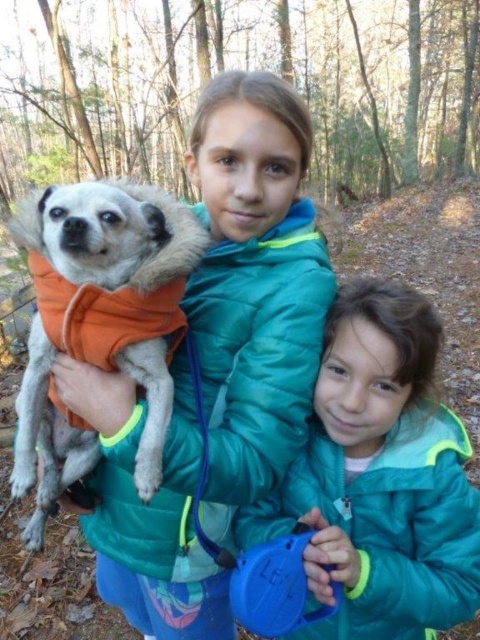
Between orange fleece dog at left and orange fleece vest at left, which one appears on the left side from the viewer's perspective?

Positioned to the left is orange fleece vest at left.

Which is in front, point (292, 410) or point (39, 529)?

Positioned in front is point (292, 410).

Is point (286, 280) positioned after point (87, 260)?

Yes, it is behind point (87, 260).

Where is `orange fleece dog at left`? orange fleece dog at left is located at coordinates (253, 285).

The image size is (480, 640). What do you see at coordinates (380, 477) in the screenshot?
I see `teal puffer jacket at lower right` at bounding box center [380, 477].

Does point (435, 404) lie in front of point (93, 346)?

No.

I want to click on teal puffer jacket at lower right, so click(x=380, y=477).

Is orange fleece dog at left to the right of teal puffer jacket at lower right from the viewer's perspective?

Incorrect, orange fleece dog at left is not on the right side of teal puffer jacket at lower right.

Does orange fleece dog at left have a lesser width compared to teal puffer jacket at lower right?

Incorrect, orange fleece dog at left's width is not less than teal puffer jacket at lower right's.

Does point (190, 593) lie behind point (342, 576)?

Yes, it is behind point (342, 576).

This screenshot has height=640, width=480. Find the location of `orange fleece dog at left`. orange fleece dog at left is located at coordinates (253, 285).